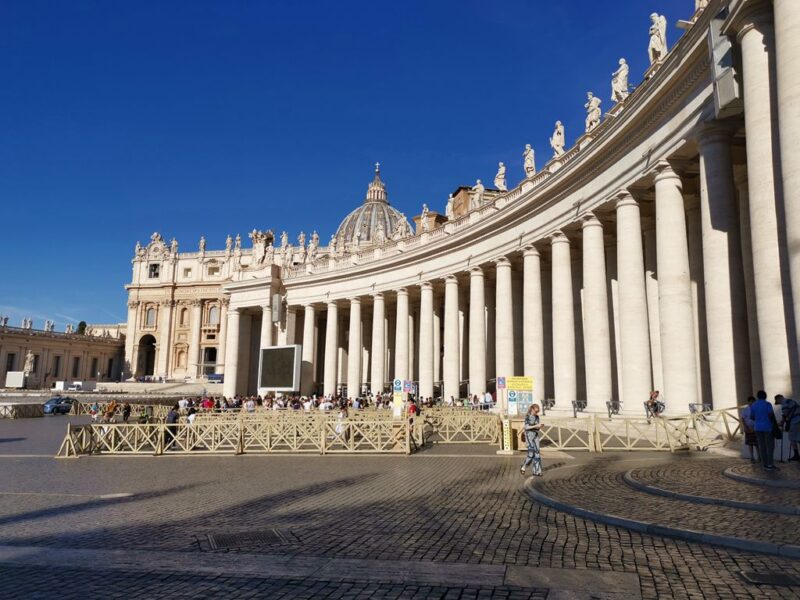
The height and width of the screenshot is (600, 800). What are the coordinates of `middle column of that row of columns` in the screenshot? It's located at (504, 311).